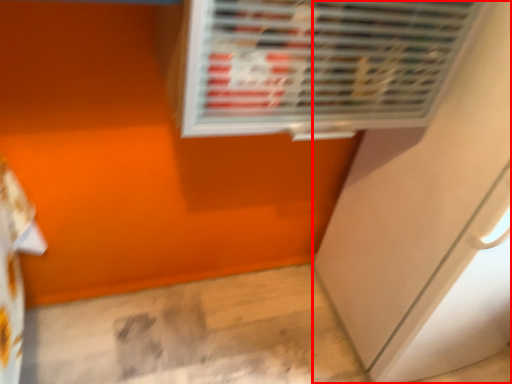
Question: From the image's perspective, what is the correct spatial relationship of screen door (annotated by the red box) in relation to air conditioning?

Choices:
 (A) below
 (B) above

Answer: (A)